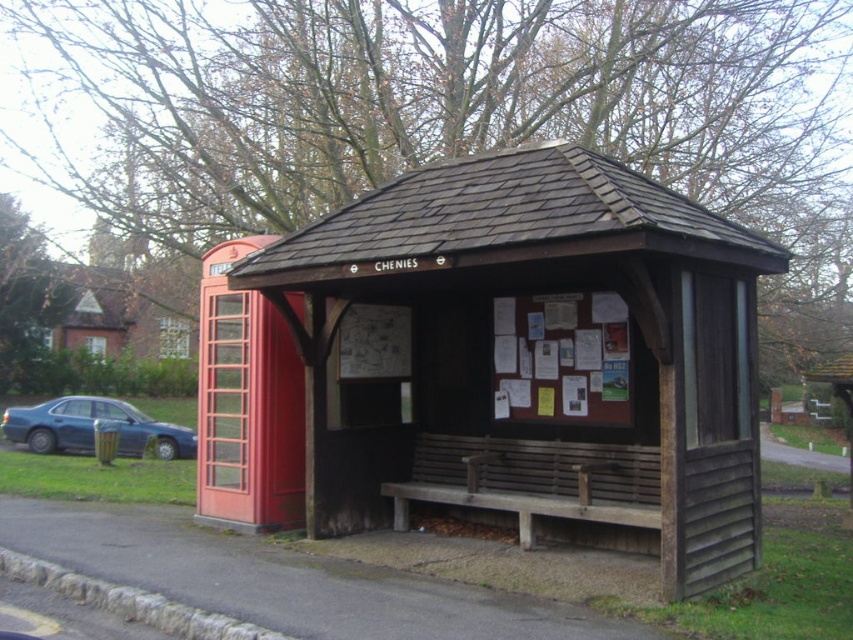
You are a tourist visiting the CHENIES bus shelter and need to sit down. You see a wooden bench at center and a weathered wood bench at center. Which one is on the left side?

The wooden bench at center is positioned on the left side of the weathered wood bench at center.

You are a delivery person needing to park your 15 feet long truck between the weathered wood bench at center and the matte blue sedan at left. Can you safely park your truck there without overlapping either vehicle?

The distance between the weathered wood bench at center and the matte blue sedan at left is 45.54 feet. Since your truck is only 15 feet long, there is ample space to park it safely between them without overlapping either vehicle.

You are standing at point (575, 220) and want to walk to point (103, 403). Given the scene described, will you have to walk towards the bus shelter or away from it?

Since point (575, 220) is in front of point (103, 403), you are currently closer to the bus shelter. To reach point (103, 403), you would need to walk away from the bus shelter.